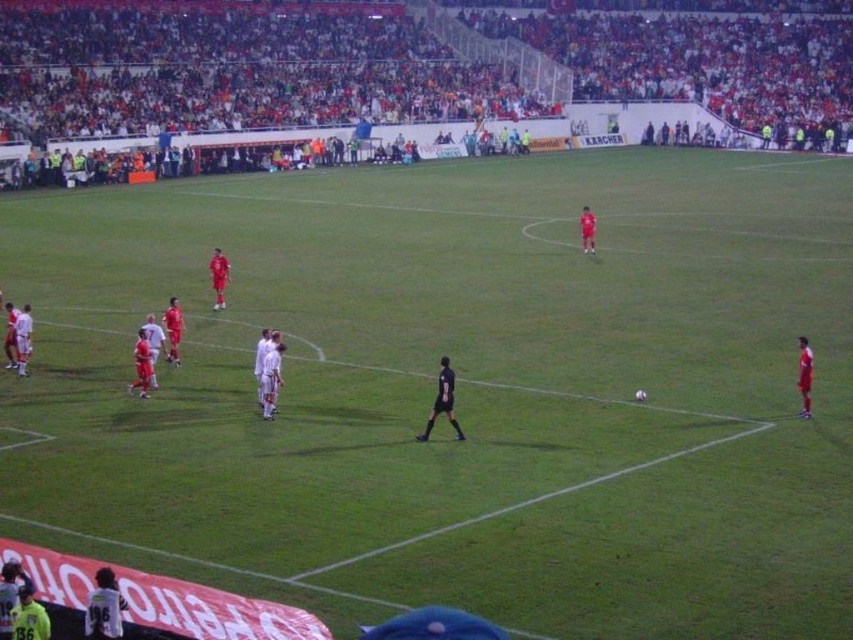
You are a soccer player positioned at the edge of the field and need to retrieve a ball that is near the white jersey at lower left. If you can run 10 meters in 3 seconds, how long will it take you to reach the ball?

The white jersey at lower left is 9.23 meters away from the viewer. Since you can run 10 meters in 3 seconds, it would take approximately 2.77 seconds to cover 9.23 meters. Therefore, you can reach the ball in about 2.8 seconds.

You are a soccer coach analyzing the field setup. You notice the white jersey at lower left and the matte red soccer player at center. Which player is positioned to the right of the other?

The white jersey at lower left is positioned on the right side of matte red soccer player at center, so the white jersey at lower left is to the right of the matte red soccer player at center.

You are a soccer coach analyzing the match. You notice two items in the lower left corner of the field. One is the matte red jersey at lower left and the other is the matte red shorts at lower left. Which item is closer to the ground?

The matte red jersey at lower left is positioned under matte red shorts at lower left, so the matte red jersey at lower left is closer to the ground.